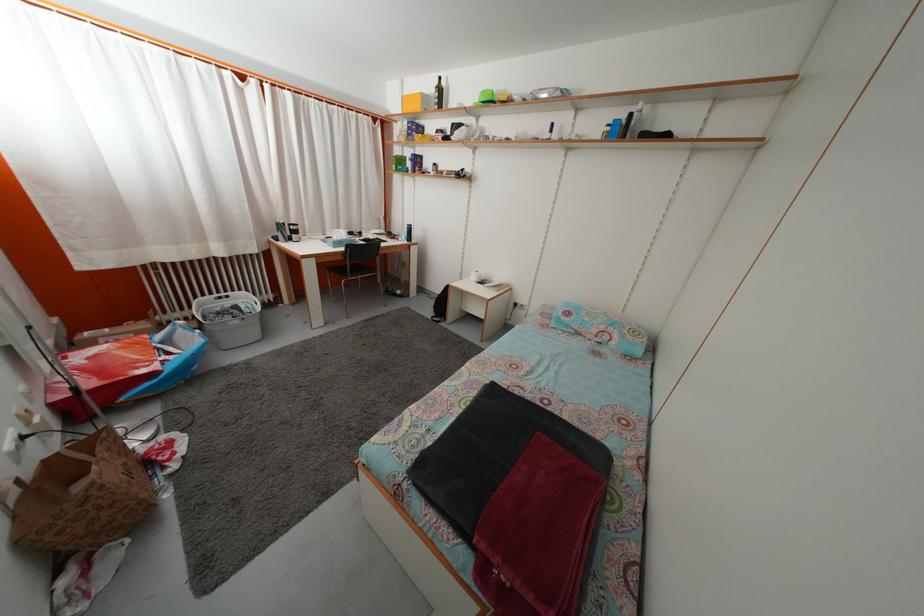
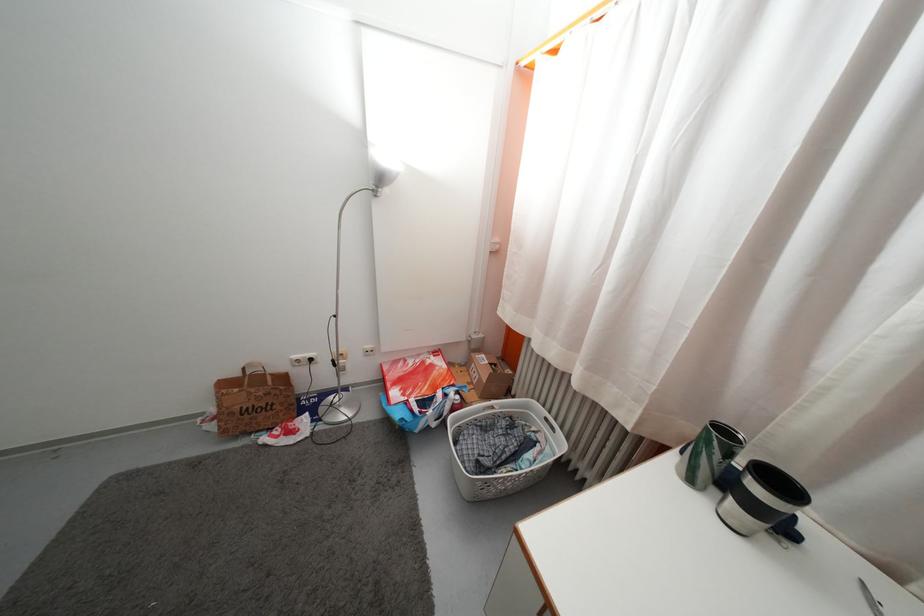
The point at (292, 248) is marked in the first image. Where is the corresponding point in the second image?

(697, 488)